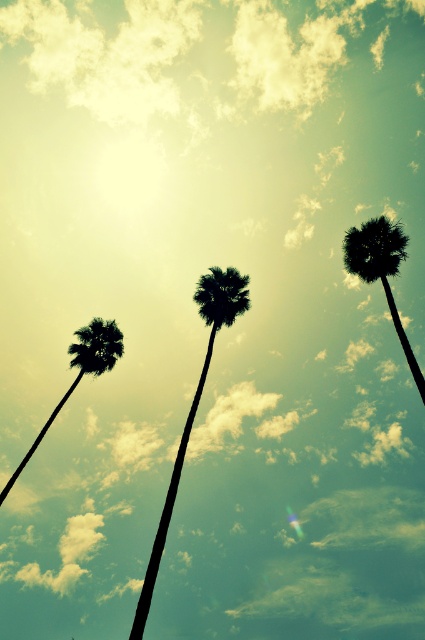
Question: Does black textured palm tree at center have a lesser width compared to silhouette palm tree at center?

Choices:
 (A) yes
 (B) no

Answer: (B)

Question: Which object appears closest to the camera in this image?

Choices:
 (A) black textured palm tree at center
 (B) silhouette palm tree at center

Answer: (A)

Question: Among these points, which one is farthest from the camera?

Choices:
 (A) (402, 256)
 (B) (51, 413)
 (C) (206, 348)

Answer: (C)

Question: From the image, what is the correct spatial relationship of black textured palm tree at center in relation to green leafy palm at left?

Choices:
 (A) right
 (B) left

Answer: (A)

Question: Based on their relative distances, which object is farther from the silhouette palm tree at center?

Choices:
 (A) black textured palm tree at center
 (B) green leafy palm at left

Answer: (B)

Question: Can you confirm if black textured palm tree at center is wider than green leafy palm at left?

Choices:
 (A) yes
 (B) no

Answer: (A)